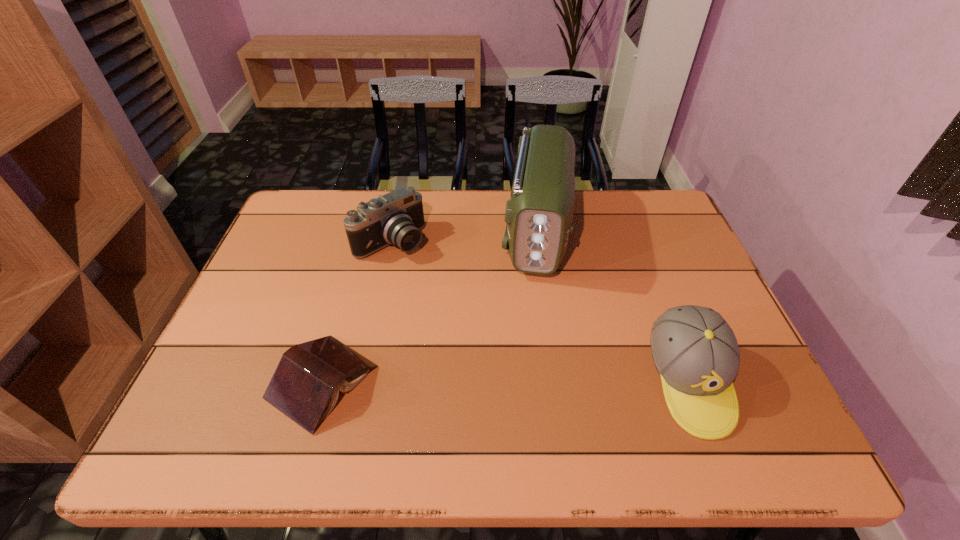
Find the location of a particular element. The image size is (960, 540). the shortest object is located at coordinates (305, 386).

Identify the location of baseball cap. (695, 351).

The height and width of the screenshot is (540, 960). What are the coordinates of `camera` in the screenshot? It's located at tap(396, 218).

Where is `the third object from left to right`? Image resolution: width=960 pixels, height=540 pixels. the third object from left to right is located at coordinates (539, 214).

Find the location of `the tallest object`. the tallest object is located at coordinates (539, 214).

Where is `vacant space situated on the back of the book`? The height and width of the screenshot is (540, 960). vacant space situated on the back of the book is located at coordinates (361, 248).

You are a GUI agent. You are given a task and a screenshot of the screen. Output one action in this format:
    pyautogui.click(x=<x>, y=<y>)
    Task: Click on the vacant space located 0.090m on the front-facing side of the camera
    
    Given the screenshot: What is the action you would take?
    pyautogui.click(x=429, y=274)

Locate an element on the screen. The height and width of the screenshot is (540, 960). free space located 0.290m on the front-facing side of the camera is located at coordinates (475, 315).

This screenshot has height=540, width=960. In order to click on free spot located 0.060m on the front-facing side of the camera in this screenshot , I will do `click(423, 268)`.

Locate an element on the screen. This screenshot has height=540, width=960. vacant point located on the front-facing side of the radio_receiver is located at coordinates (532, 332).